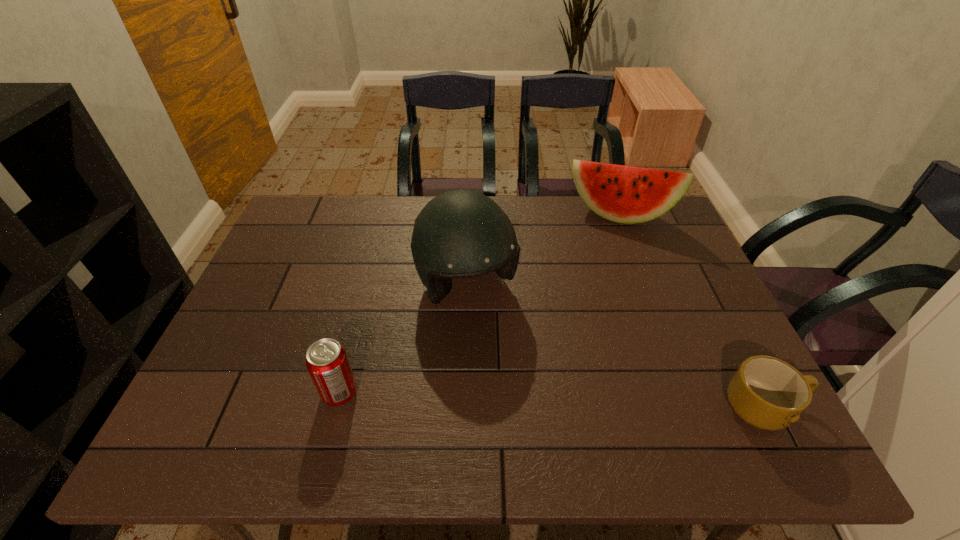
I want to click on free space located at the face opening of the tallest object, so click(x=517, y=371).

The width and height of the screenshot is (960, 540). Identify the location of free location located 0.140m on the outer rind of the watermelon. (605, 260).

I want to click on vacant space located 0.290m on the outer rind of the watermelon, so click(598, 295).

Locate an element on the screen. vacant space situated 0.360m on the outer rind of the watermelon is located at coordinates (594, 314).

I want to click on object at the far edge, so click(624, 194).

The image size is (960, 540). Find the location of `soda positioned at the near edge`. soda positioned at the near edge is located at coordinates (326, 360).

At what (x,y) coordinates should I click in order to perform the action: click on mug that is at the near edge. Please return your answer as a coordinate pair (x, y). The height and width of the screenshot is (540, 960). Looking at the image, I should click on (768, 393).

At what (x,y) coordinates should I click in order to perform the action: click on mug present at the right edge. Please return your answer as a coordinate pair (x, y). This screenshot has width=960, height=540. Looking at the image, I should click on (768, 393).

This screenshot has width=960, height=540. Find the location of `watermelon that is at the right edge`. watermelon that is at the right edge is located at coordinates (624, 194).

This screenshot has height=540, width=960. In order to click on object at the far right corner in this screenshot , I will do `click(624, 194)`.